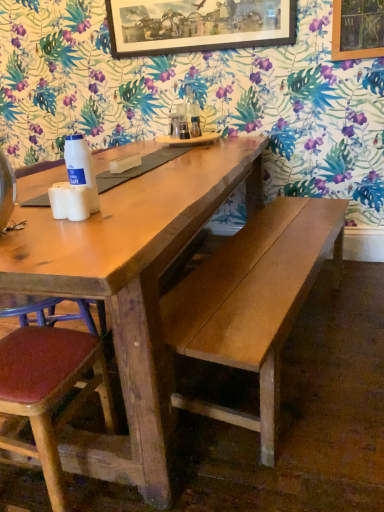
Where is `brown wood chair at lower left`? brown wood chair at lower left is located at coordinates (48, 384).

Measure the distance between white matte salt shaker at left and camera.

white matte salt shaker at left is 1.13 meters away from camera.

You are a GUI agent. You are given a task and a screenshot of the screen. Output one action in this format:
    pyautogui.click(x=<x>, y=<y>)
    Task: Click on the wooden bench at center
    This screenshot has height=512, width=384.
    Given the screenshot: What is the action you would take?
    tap(253, 302)

Measure the distance from brown wood chair at lower left to wooden bench at center.

The distance of brown wood chair at lower left from wooden bench at center is 21.54 inches.

Looking at their sizes, would you say brown wood chair at lower left is wider or thinner than wooden bench at center?

Considering their sizes, brown wood chair at lower left looks slimmer than wooden bench at center.

From a real-world perspective, which is physically below, brown wood chair at lower left or wooden bench at center?

brown wood chair at lower left, from a real-world perspective.

In the scene shown: From the image's perspective, who appears lower, brown wood chair at lower left or wooden bench at center?

From the image's view, brown wood chair at lower left is below.

Is white matte salt shaker at left beside brown wood chair at lower left?

white matte salt shaker at left and brown wood chair at lower left are clearly separated.

Who is smaller, white matte salt shaker at left or brown wood chair at lower left?

With smaller size is white matte salt shaker at left.

Considering the positions of point (92, 192) and point (46, 473), is point (92, 192) closer or farther from the camera than point (46, 473)?

Clearly, point (92, 192) is more distant from the camera than point (46, 473).

Considering the positions of objects white matte salt shaker at left and brown wood chair at lower left in the image provided, who is in front, white matte salt shaker at left or brown wood chair at lower left?

brown wood chair at lower left.

This screenshot has width=384, height=512. Identify the location of bottle located underneath the wooden framed artwork at upper center (from a real-world perspective). (81, 168).

Based on the photo, does wooden framed artwork at upper center contain white matte salt shaker at left?

Actually, white matte salt shaker at left is outside wooden framed artwork at upper center.

Does point (254, 27) appear closer or farther from the camera than point (80, 182)?

Point (254, 27) appears to be farther away from the viewer than point (80, 182).

Based on their sizes in the image, would you say wooden framed artwork at upper center is bigger or smaller than white matte salt shaker at left?

In the image, wooden framed artwork at upper center appears to be larger than white matte salt shaker at left.

Does wooden tray at center touch white matte salt shaker at left?

wooden tray at center is not next to white matte salt shaker at left, and they're not touching.

Is wooden tray at center in front of or behind white matte salt shaker at left in the image?

Visually, wooden tray at center is located behind white matte salt shaker at left.

Does wooden tray at center have a lesser height compared to white matte salt shaker at left?

Yes.

Choose the correct answer: Is wooden tray at center inside white matte salt shaker at left or outside it?

wooden tray at center is spatially situated outside white matte salt shaker at left.

Is wooden tray at center inside white matte salt shaker at left?

No, wooden tray at center is not inside white matte salt shaker at left.

Consider the image. Considering the sizes of objects white matte salt shaker at left and wooden tray at center in the image provided, who is wider, white matte salt shaker at left or wooden tray at center?

wooden tray at center.

From a real-world perspective, is white matte salt shaker at left physically below wooden tray at center?

No.

Does white matte salt shaker at left turn towards wooden tray at center?

No.

Who is taller, white matte salt shaker at left or wooden bench at center?

With more height is wooden bench at center.

Is white matte salt shaker at left oriented away from wooden bench at center?

No, white matte salt shaker at left is not facing the opposite direction of wooden bench at center.

Are white matte salt shaker at left and wooden bench at center far apart?

No, white matte salt shaker at left is not far away from wooden bench at center.

Find the location of a particular element. bottle that is on the left side of wooden bench at center is located at coordinates (81, 168).

From the picture: Can you confirm if wooden framed artwork at upper center is bigger than wooden bench at center?

Incorrect, wooden framed artwork at upper center is not larger than wooden bench at center.

Would you say wooden framed artwork at upper center is to the left or to the right of wooden bench at center in the picture?

Clearly, wooden framed artwork at upper center is on the left of wooden bench at center in the image.

Is point (141, 40) closer or farther from the camera than point (272, 216)?

Clearly, point (141, 40) is more distant from the camera than point (272, 216).

The image size is (384, 512). I want to click on bench located on the right of brown wood chair at lower left, so click(253, 302).

Find the location of a particular element. The image size is (384, 512). chair that appears on the left of white matte salt shaker at left is located at coordinates (48, 384).

Estimate the real-world distances between objects in this image. Which object is closer to wooden bench at center, wooden framed artwork at upper center or white matte salt shaker at left?

white matte salt shaker at left is positioned closer to the anchor wooden bench at center.

Based on their spatial positions, is brown wood chair at lower left or wooden tray at center further from wooden framed artwork at upper center?

Based on the image, brown wood chair at lower left appears to be further to wooden framed artwork at upper center.

Which object lies further to the anchor point wooden framed artwork at upper center, white matte salt shaker at left or wooden bench at center?

Based on the image, white matte salt shaker at left appears to be further to wooden framed artwork at upper center.

When comparing their distances from wooden bench at center, does wooden framed artwork at upper center or wooden tray at center seem further?

Among the two, wooden framed artwork at upper center is located further to wooden bench at center.

Estimate the real-world distances between objects in this image. Which object is closer to wooden framed artwork at upper center, white matte salt shaker at left or brown wood chair at lower left?

white matte salt shaker at left is closer to wooden framed artwork at upper center.

From the image, which object appears to be nearer to white matte salt shaker at left, wooden bench at center or wooden tray at center?

wooden bench at center.

From the image, which object appears to be farther from wooden bench at center, brown wood chair at lower left or white matte salt shaker at left?

Among the two, white matte salt shaker at left is located further to wooden bench at center.

Considering their positions, is brown wood chair at lower left positioned closer to wooden bench at center than wooden framed artwork at upper center?

Based on the image, brown wood chair at lower left appears to be nearer to wooden bench at center.

Where is `bottle between wooden framed artwork at upper center and wooden bench at center from top to bottom`? Image resolution: width=384 pixels, height=512 pixels. bottle between wooden framed artwork at upper center and wooden bench at center from top to bottom is located at coordinates (81, 168).

You are a GUI agent. You are given a task and a screenshot of the screen. Output one action in this format:
    pyautogui.click(x=<x>, y=<y>)
    Task: Click on the plate between wooden framed artwork at upper center and brown wood chair at lower left vertically
    
    Given the screenshot: What is the action you would take?
    pyautogui.click(x=190, y=140)

Where is `bottle located between brown wood chair at lower left and wooden tray at center in the depth direction`? bottle located between brown wood chair at lower left and wooden tray at center in the depth direction is located at coordinates (81, 168).

At what (x,y) coordinates should I click in order to perform the action: click on bench positioned between brown wood chair at lower left and wooden tray at center from near to far. Please return your answer as a coordinate pair (x, y). The image size is (384, 512). Looking at the image, I should click on (253, 302).